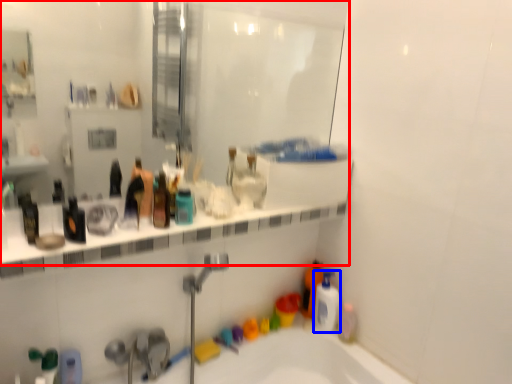
Question: Which point is further to the camera, mirror (highlighted by a red box) or mouthwash (highlighted by a blue box)?

Choices:
 (A) mirror
 (B) mouthwash

Answer: (B)